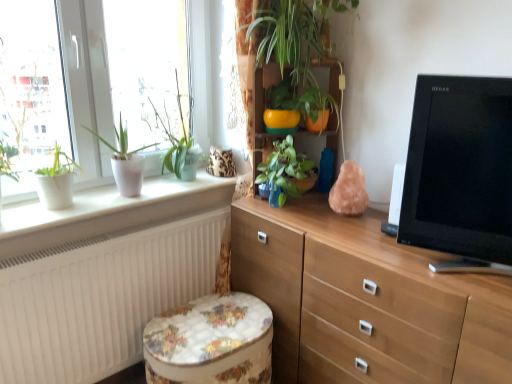
I want to click on vacant space underneath black glossy tv at right (from a real-world perspective), so click(449, 276).